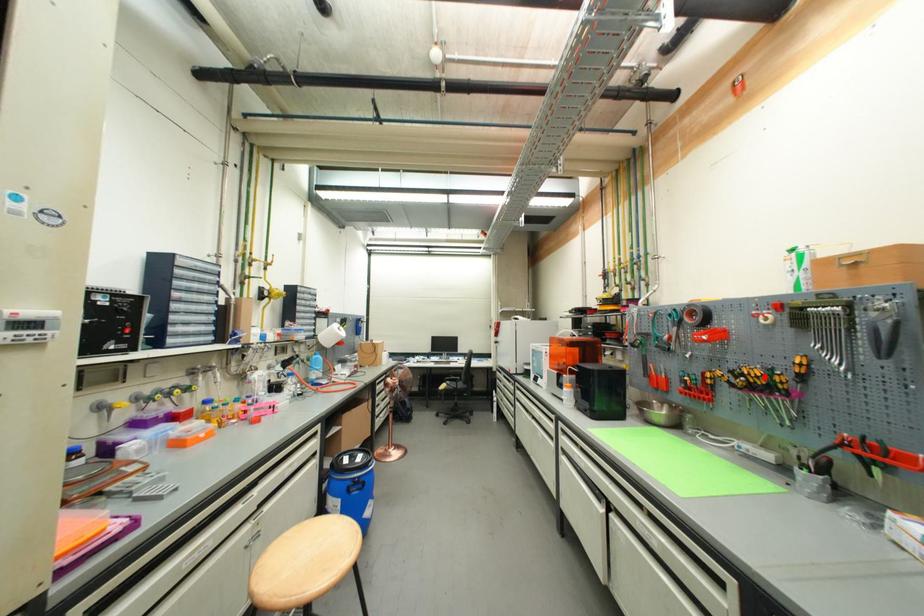
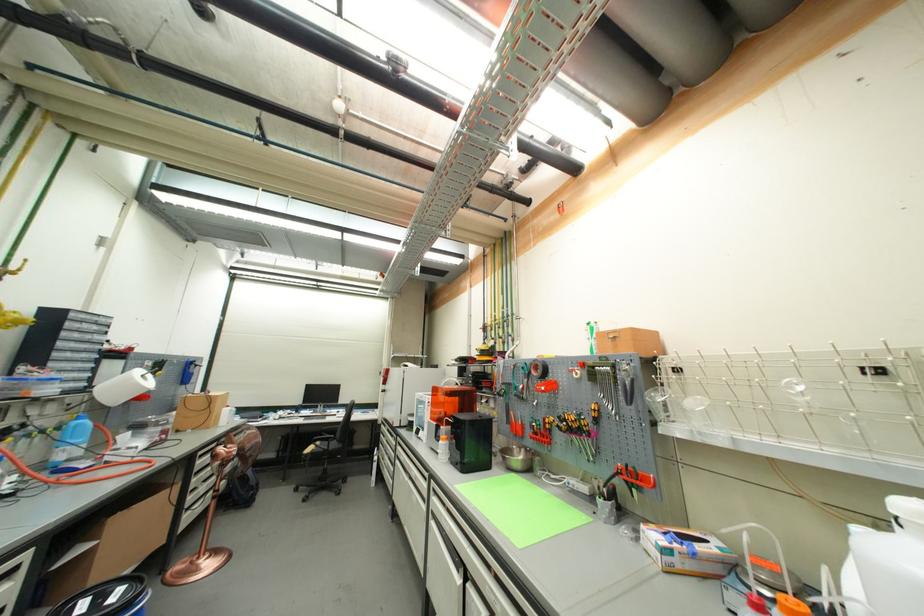
Find the pixel in the second image that matches the highlighted location in the first image.

(578, 421)